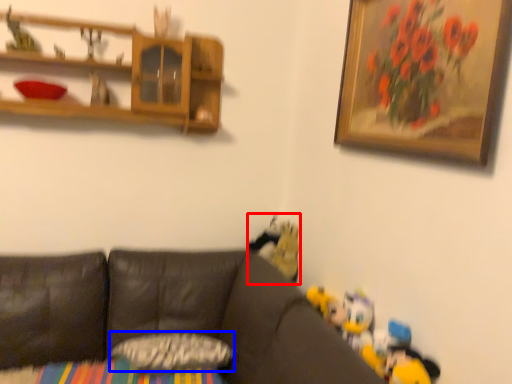
Question: Among these objects, which one is farthest to the camera, toy (highlighted by a red box) or pillow (highlighted by a blue box)?

Choices:
 (A) toy
 (B) pillow

Answer: (A)